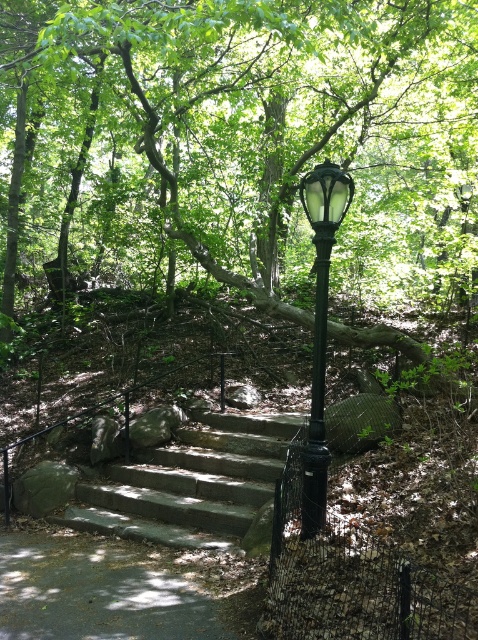
You are standing at the base of the stone steps in the park scene and want to walk towards the two points marked in the image. Which point, point (329, 243) or point (318, 376), will you reach first?

You will reach point (329, 243) first because it is closer to you than point (318, 376), which is further away.

You are a maintenance worker needing to reach the gray stone stairs at center from the black glass lamp post at center. Given that your tool cart is 6 feet long, can you maneuver it easily between them?

The gray stone stairs at center is 5.82 feet from the black glass lamp post at center. Since the tool cart is 6 feet long, it will not fit between them as the distance is shorter than the cart.